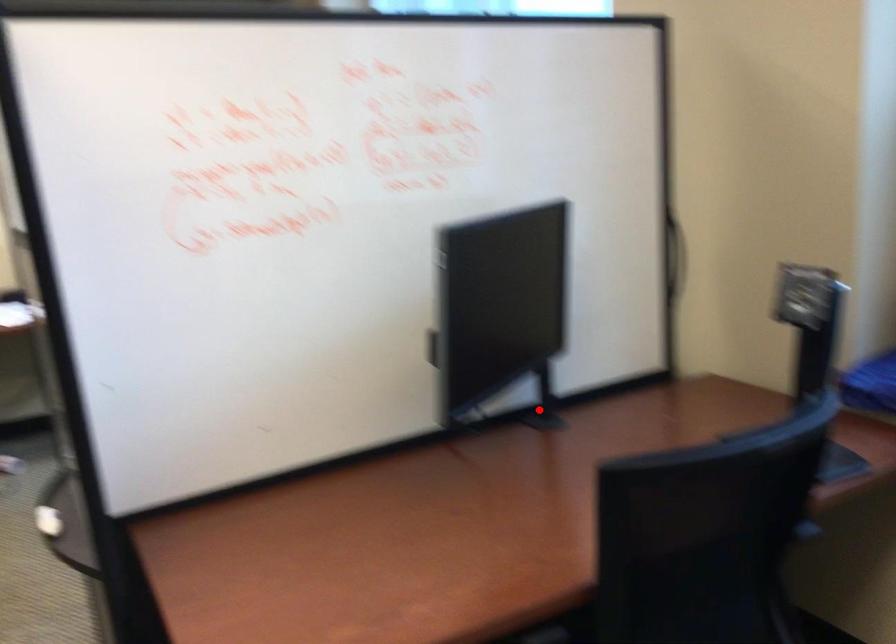
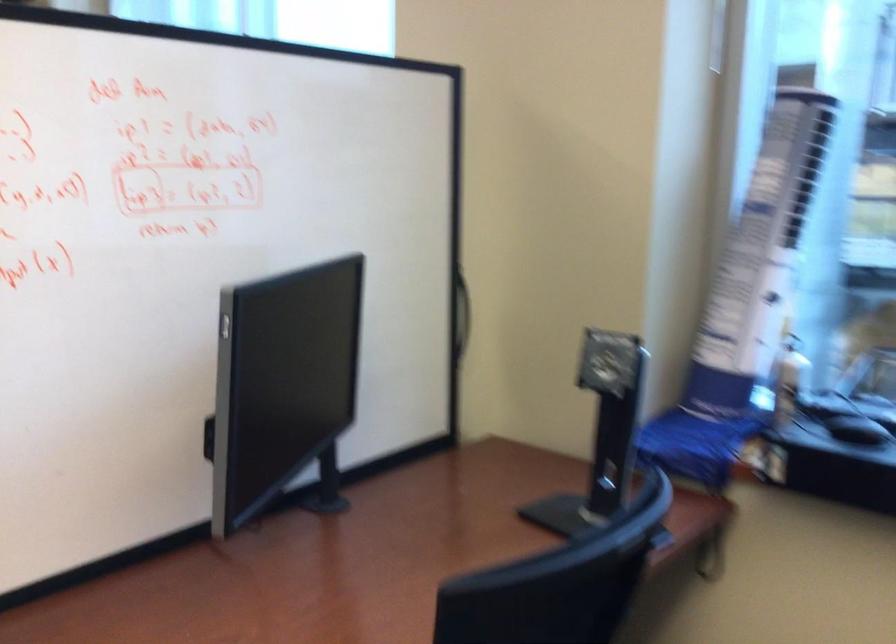
Question: I am providing you with two images of the same scene from different viewpoints. Image1 has a red point marked. In image2, the corresponding 3D location appears at what relative position? Reply with the corresponding letter.

Choices:
 (A) Closer
 (B) Farther

Answer: (A)